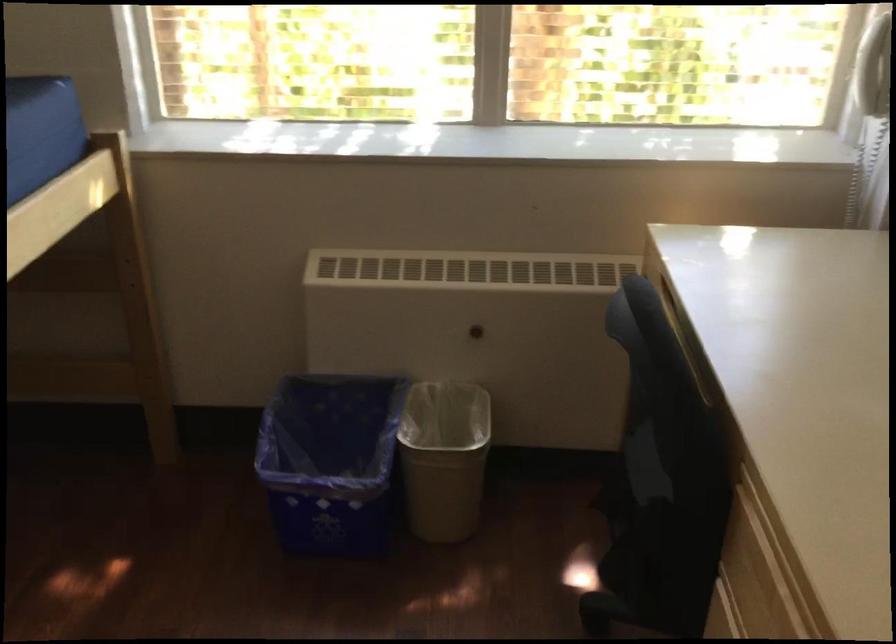
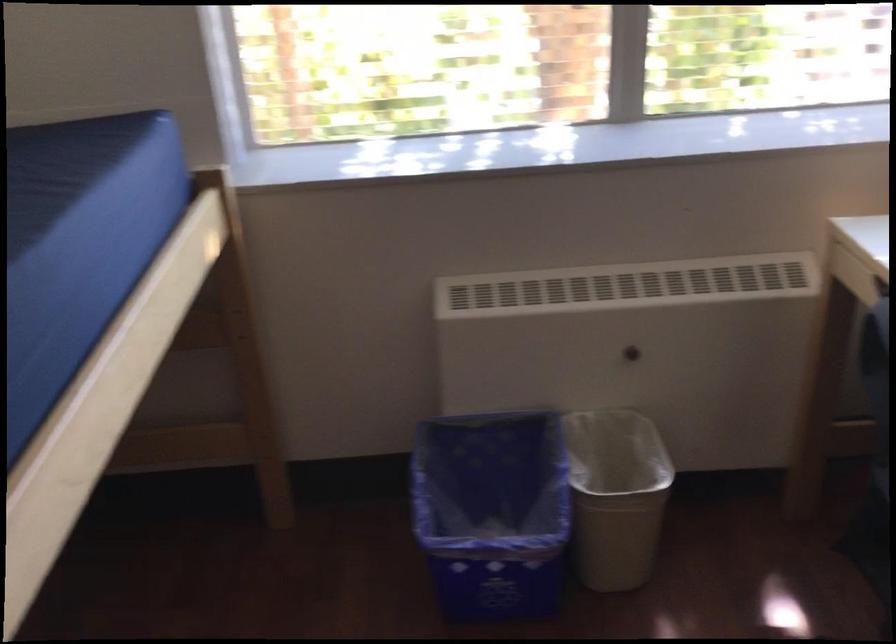
Find the pixel in the second image that matches [478,330] in the first image.

(634, 351)